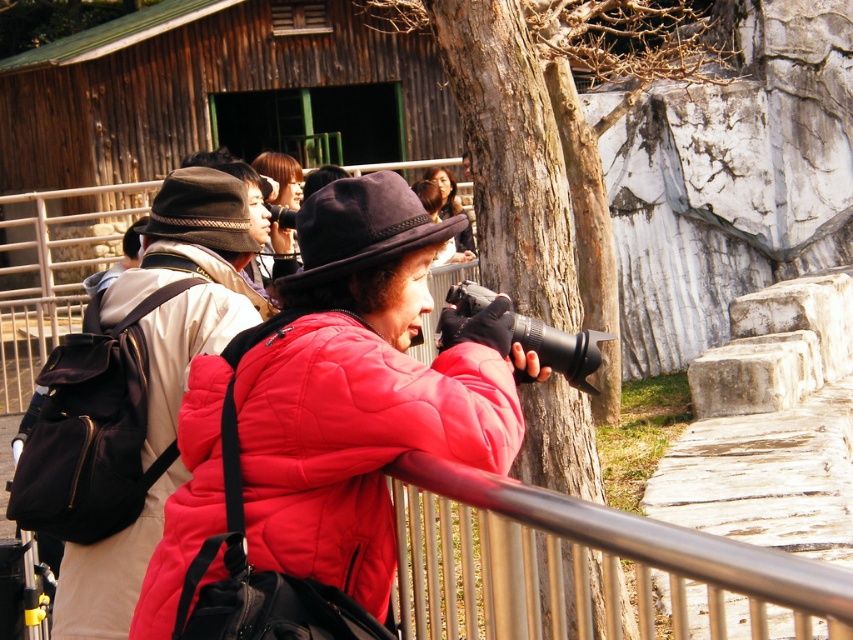
You are a photographer carrying a 3.5 feet wide equipment case and need to move between the matte red puffer jacket at center and the matte black backpack at left. Based on the scene, can you fit through the space between them?

The space between the matte red puffer jacket at center and the matte black backpack at left is 4.16 feet. Since your equipment case is 3.5 feet wide, it should fit through the space as it is wider than the case.

You are part of a photography group standing near a metal railing. You need to pass the matte red puffer jacket at center and the matte black backpack at left to reach the exit. Which object should you move past first?

The matte black backpack at left is on the left side of the matte red puffer jacket at center, so you should move past the matte black backpack at left first to reach the exit.